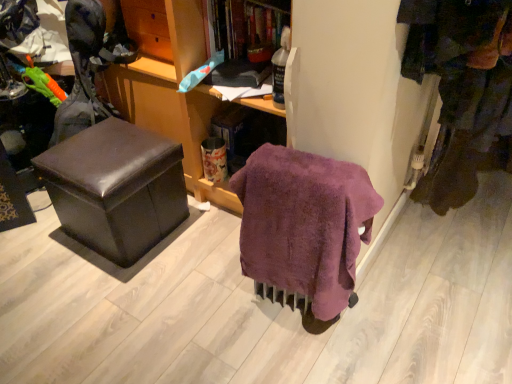
Describe the element at coordinates (462, 88) in the screenshot. The image size is (512, 384). I see `dark brown fabric pants at right` at that location.

This screenshot has height=384, width=512. I want to click on wooden cabinet at center, so click(172, 91).

This screenshot has width=512, height=384. What do you see at coordinates (245, 37) in the screenshot? I see `wooden bookshelf at upper center, positioned as the 2th shelf in left-to-right order` at bounding box center [245, 37].

The image size is (512, 384). What are the coordinates of `wooden bookshelf at upper center, the 1th shelf when ordered from right to left` in the screenshot? It's located at pyautogui.click(x=245, y=37).

Find the location of a particular element. shiny brown ottoman at left is located at coordinates (116, 188).

The image size is (512, 384). What do you see at coordinates (304, 223) in the screenshot?
I see `purple fluffy blanket at center` at bounding box center [304, 223].

In order to click on dark brown fabric pants at right in this screenshot , I will do `click(462, 88)`.

In the scene shown: In the image, is shiny brown ottoman at left positioned in front of or behind wooden bookshelf at upper center, the 1th shelf when ordered from right to left?

shiny brown ottoman at left is positioned farther from the viewer than wooden bookshelf at upper center, the 1th shelf when ordered from right to left.

Locate an element on the screen. Image resolution: width=512 pixels, height=384 pixels. shelf in front of the shiny brown ottoman at left is located at coordinates (245, 37).

How many degrees apart are the facing directions of shiny brown ottoman at left and wooden bookshelf at upper center, the 1th shelf when ordered from right to left?

They differ by 90 degrees in their facing directions.

Considering the relative sizes of shiny brown ottoman at left and wooden bookshelf at upper center, the 1th shelf when ordered from right to left, in the image provided, is shiny brown ottoman at left thinner than wooden bookshelf at upper center, the 1th shelf when ordered from right to left,?

Incorrect, the width of shiny brown ottoman at left is not less than that of wooden bookshelf at upper center, the 1th shelf when ordered from right to left.

From a real-world perspective, is wooden bookshelf at upper center, the 1th shelf when ordered from right to left, physically located above or below purple fluffy blanket at center?

From a real-world perspective, wooden bookshelf at upper center, the 1th shelf when ordered from right to left, is physically above purple fluffy blanket at center.

Is purple fluffy blanket at center surrounded by wooden bookshelf at upper center, positioned as the 2th shelf in left-to-right order?

No, purple fluffy blanket at center is located outside of wooden bookshelf at upper center, positioned as the 2th shelf in left-to-right order.

How different are the orientations of wooden bookshelf at upper center, the 1th shelf when ordered from right to left, and purple fluffy blanket at center in degrees?

There is a 4.21-degree angle between the facing directions of wooden bookshelf at upper center, the 1th shelf when ordered from right to left, and purple fluffy blanket at center.

Which is more to the left, wooden bookshelf at upper center, positioned as the 2th shelf in left-to-right order, or purple fluffy blanket at center?

wooden bookshelf at upper center, positioned as the 2th shelf in left-to-right order, is more to the left.

Is point (277, 25) behind point (477, 102)?

Yes, it is behind point (477, 102).

Is the depth of wooden bookshelf at upper center, the 1th shelf when ordered from right to left, greater than that of dark brown fabric pants at right?

No, wooden bookshelf at upper center, the 1th shelf when ordered from right to left, is in front of dark brown fabric pants at right.

From a real-world perspective, count 2nd shelfs upward from the dark brown fabric pants at right and point to it. Please provide its 2D coordinates.

[(245, 37)]

Is wooden cabinet at center surrounded by shiny brown ottoman at left?

No, wooden cabinet at center is not surrounded by shiny brown ottoman at left.

Which is further, (161, 168) or (131, 37)?

The point (131, 37) is farther from the camera.

Considering the relative sizes of shiny brown ottoman at left and wooden cabinet at center in the image provided, is shiny brown ottoman at left taller than wooden cabinet at center?

In fact, shiny brown ottoman at left may be shorter than wooden cabinet at center.

From a real-world perspective, is wooden cabinet at center located higher than shiny brown ottoman at left?

Yes, from a real-world perspective, wooden cabinet at center is on top of shiny brown ottoman at left.

Do you think wooden cabinet at center is within shiny brown ottoman at left, or outside of it?

wooden cabinet at center is outside shiny brown ottoman at left.

Considering the sizes of objects wooden cabinet at center and shiny brown ottoman at left in the image provided, who is bigger, wooden cabinet at center or shiny brown ottoman at left?

wooden cabinet at center is bigger.

Considering the positions of objects wooden shelf at upper center, positioned as the 2th shelf in right-to-left order, and purple fluffy blanket at center in the image provided, who is in front, wooden shelf at upper center, positioned as the 2th shelf in right-to-left order, or purple fluffy blanket at center?

purple fluffy blanket at center is in front.

Between point (194, 53) and point (248, 229), which one is positioned in front?

Point (248, 229)

In the scene shown: Does wooden shelf at upper center, which ranks as the first shelf in left-to-right order, turn towards purple fluffy blanket at center?

No, wooden shelf at upper center, which ranks as the first shelf in left-to-right order, is not facing towards purple fluffy blanket at center.

From the picture: Is wooden shelf at upper center, which ranks as the first shelf in left-to-right order, to the right of purple fluffy blanket at center from the viewer's perspective?

Incorrect, wooden shelf at upper center, which ranks as the first shelf in left-to-right order, is not on the right side of purple fluffy blanket at center.

From the image's perspective, does dark brown fabric pants at right appear lower than wooden cabinet at center?

Yes.

Considering the relative sizes of dark brown fabric pants at right and wooden cabinet at center in the image provided, is dark brown fabric pants at right wider than wooden cabinet at center?

No.

Does dark brown fabric pants at right come in front of wooden cabinet at center?

No.

Is dark brown fabric pants at right completely or partially outside of wooden cabinet at center?

Yes.

At what (x,y) coordinates should I click in order to perform the action: click on furniture below the wooden bookshelf at upper center, the 1th shelf when ordered from right to left (from the image's perspective). Please return your answer as a coordinate pair (x, y). Looking at the image, I should click on [116, 188].

At what (x,y) coordinates should I click in order to perform the action: click on blanket that appears in front of the wooden bookshelf at upper center, positioned as the 2th shelf in left-to-right order. Please return your answer as a coordinate pair (x, y). This screenshot has height=384, width=512. Looking at the image, I should click on (304, 223).

From the image, which object appears to be farther from shiny brown ottoman at left, wooden shelf at upper center, which ranks as the first shelf in left-to-right order, or wooden cabinet at center?

Based on the image, wooden shelf at upper center, which ranks as the first shelf in left-to-right order, appears to be further to shiny brown ottoman at left.

Estimate the real-world distances between objects in this image. Which object is further from wooden bookshelf at upper center, the 1th shelf when ordered from right to left, wooden shelf at upper center, which ranks as the first shelf in left-to-right order, or shiny brown ottoman at left?

The object further to wooden bookshelf at upper center, the 1th shelf when ordered from right to left, is shiny brown ottoman at left.

Which object lies nearer to the anchor point wooden cabinet at center, wooden bookshelf at upper center, the 1th shelf when ordered from right to left, or dark brown fabric pants at right?

wooden bookshelf at upper center, the 1th shelf when ordered from right to left, is closer to wooden cabinet at center.

From the image, which object appears to be nearer to shiny brown ottoman at left, wooden shelf at upper center, positioned as the 2th shelf in right-to-left order, or purple fluffy blanket at center?

wooden shelf at upper center, positioned as the 2th shelf in right-to-left order, lies closer to shiny brown ottoman at left than the other object.

From the image, which object appears to be farther from wooden shelf at upper center, which ranks as the first shelf in left-to-right order, purple fluffy blanket at center or shiny brown ottoman at left?

The object further to wooden shelf at upper center, which ranks as the first shelf in left-to-right order, is purple fluffy blanket at center.

Based on their spatial positions, is shiny brown ottoman at left or dark brown fabric pants at right closer to purple fluffy blanket at center?

The object closer to purple fluffy blanket at center is dark brown fabric pants at right.

Which object lies further to the anchor point wooden shelf at upper center, positioned as the 2th shelf in right-to-left order, dark brown fabric pants at right or purple fluffy blanket at center?

dark brown fabric pants at right is further to wooden shelf at upper center, positioned as the 2th shelf in right-to-left order.

Considering their positions, is wooden shelf at upper center, positioned as the 2th shelf in right-to-left order, positioned further to wooden bookshelf at upper center, positioned as the 2th shelf in left-to-right order, than dark brown fabric pants at right?

Among the two, dark brown fabric pants at right is located further to wooden bookshelf at upper center, positioned as the 2th shelf in left-to-right order.

Locate an element on the screen. The image size is (512, 384). shelf between wooden shelf at upper center, which ranks as the first shelf in left-to-right order, and purple fluffy blanket at center, in the vertical direction is located at coordinates (245, 37).

Locate an element on the screen. furniture between wooden cabinet at center and dark brown fabric pants at right in the horizontal direction is located at coordinates (116, 188).

At what (x,y) coordinates should I click in order to perform the action: click on cabinetry between wooden shelf at upper center, positioned as the 2th shelf in right-to-left order, and purple fluffy blanket at center in the up-down direction. Please return your answer as a coordinate pair (x, y). This screenshot has width=512, height=384. Looking at the image, I should click on (172, 91).

Find the location of a particular element. The height and width of the screenshot is (384, 512). shelf between wooden shelf at upper center, which ranks as the first shelf in left-to-right order, and dark brown fabric pants at right is located at coordinates (245, 37).